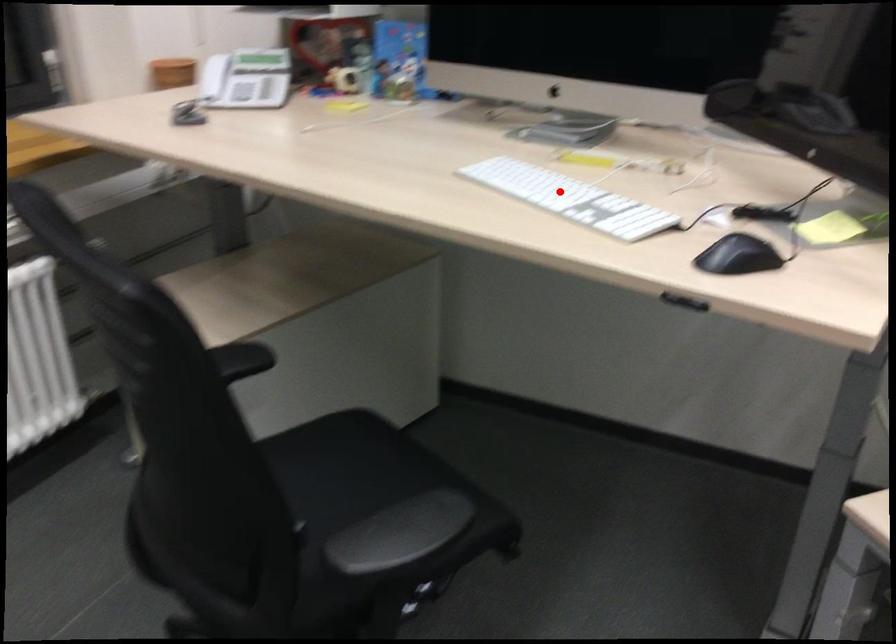
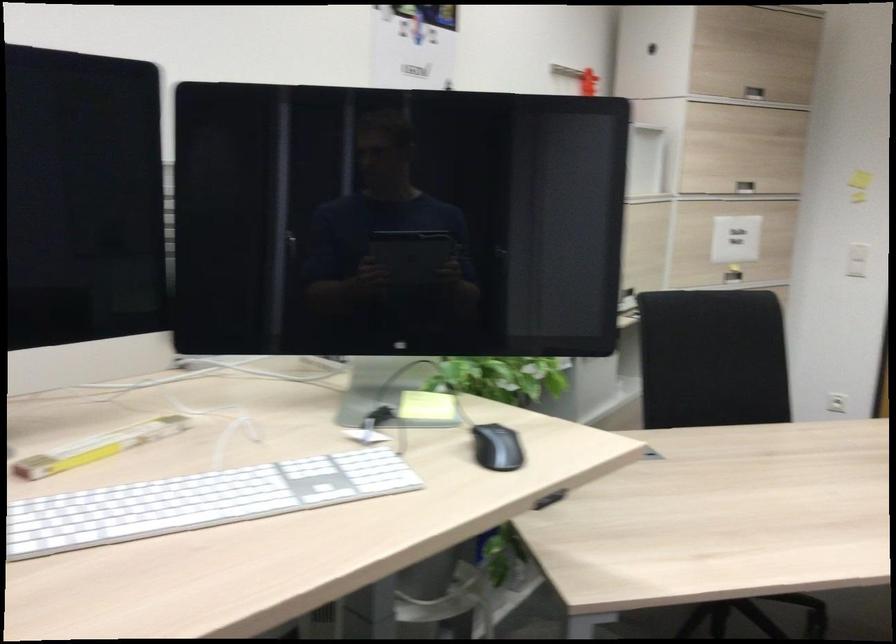
Question: I am providing you with two images of the same scene from different viewpoints. In image1, a red point is highlighted. Considering the same 3D point in image2, which of the following is correct?

Choices:
 (A) It is closer
 (B) It is farther

Answer: (A)